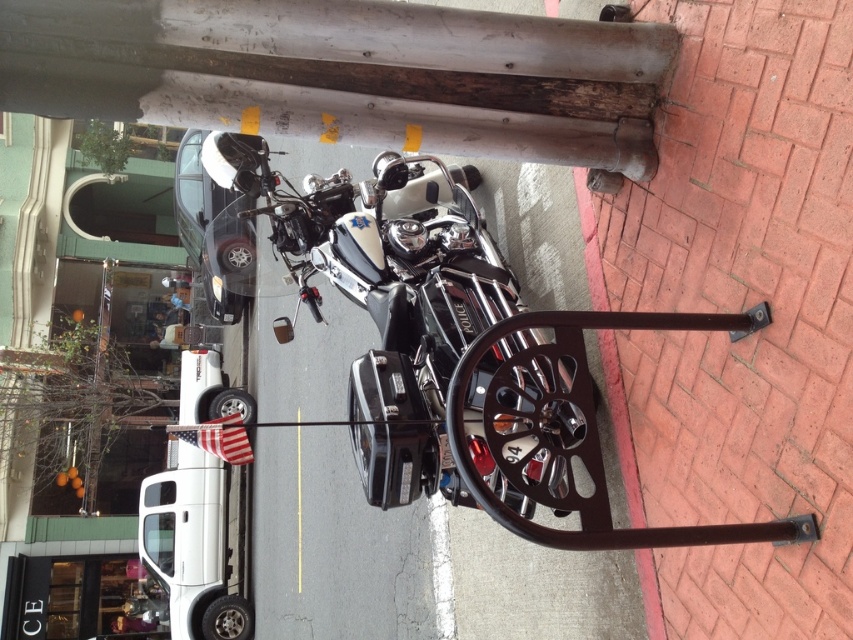
Who is positioned more to the right, shiny chrome motorcycle at center or brick at lower right?

Positioned to the right is brick at lower right.

The height and width of the screenshot is (640, 853). In order to click on shiny chrome motorcycle at center in this screenshot , I will do `click(387, 292)`.